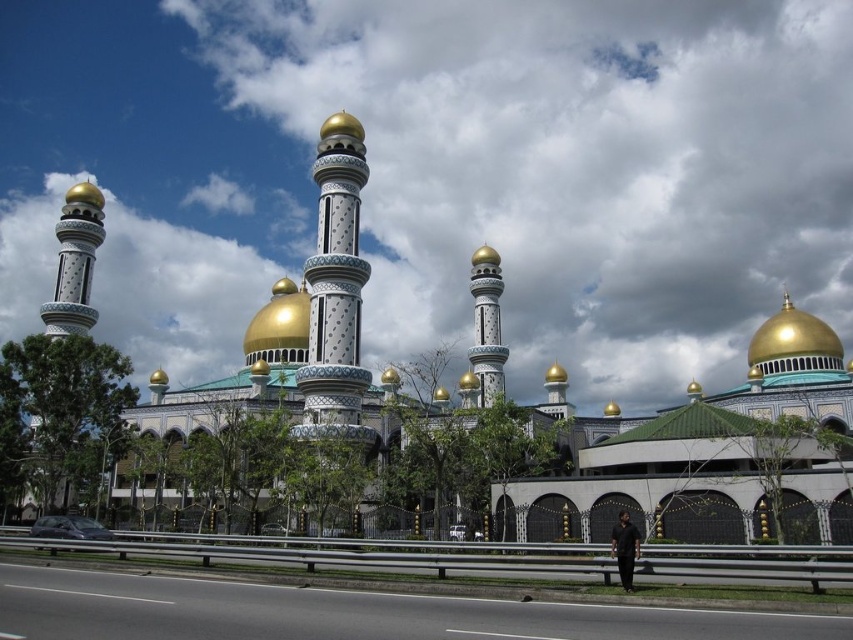
Does point (619, 627) come farther from viewer compared to point (254, 342)?

No, (619, 627) is closer to viewer.

Does asphalt road at lower center have a larger size compared to gold polished dome at center?

Actually, asphalt road at lower center might be smaller than gold polished dome at center.

Find the location of a particular element. This screenshot has width=853, height=640. asphalt road at lower center is located at coordinates (344, 612).

Identify the location of gold mosaic minaret at center. (335, 291).

You are a GUI agent. You are given a task and a screenshot of the screen. Output one action in this format:
    pyautogui.click(x=<x>, y=<y>)
    Task: Click on the gold mosaic minaret at center
    The image size is (853, 640).
    Given the screenshot: What is the action you would take?
    pyautogui.click(x=335, y=291)

This screenshot has height=640, width=853. In order to click on gold mosaic minaret at center in this screenshot , I will do `click(335, 291)`.

Between point (328, 305) and point (770, 358), which one is positioned in front?

Point (328, 305) is more forward.

Which is behind, point (344, 332) or point (824, 369)?

Positioned behind is point (824, 369).

The height and width of the screenshot is (640, 853). Identify the location of gold mosaic minaret at center. (335, 291).